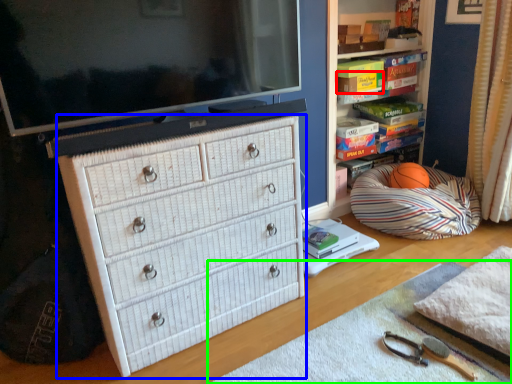
Question: Based on their relative distances, which object is farther from book (highlighted by a red box)? Choose from chest of drawers (highlighted by a blue box) and plain (highlighted by a green box).

Choices:
 (A) chest of drawers
 (B) plain

Answer: (B)